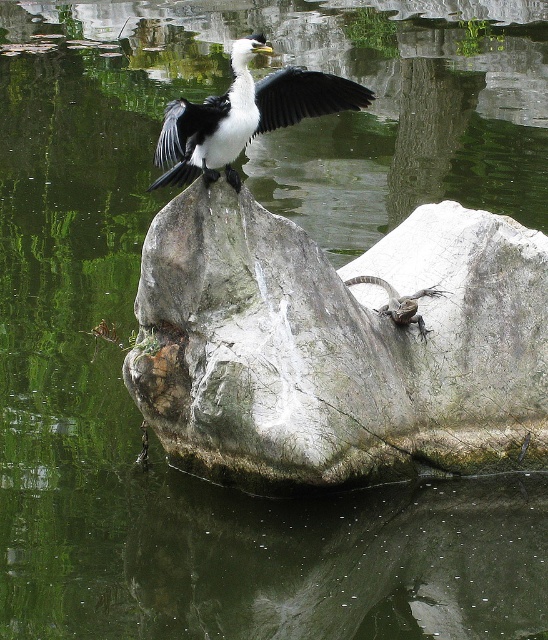
Can you confirm if gray stone boulder at center is shorter than white-feathered bird with black wings at center?

Yes.

Between gray stone boulder at center and white-feathered bird with black wings at center, which one appears on the left side from the viewer's perspective?

From the viewer's perspective, white-feathered bird with black wings at center appears more on the left side.

Locate an element on the screen. gray stone boulder at center is located at coordinates (338, 348).

Which of these two, white-feathered bird with black wings at center or black feathered wing at upper center, stands shorter?

black feathered wing at upper center is shorter.

Is the position of white-feathered bird with black wings at center less distant than that of black feathered wing at upper center?

Yes, white-feathered bird with black wings at center is closer to the viewer.

Which is in front, point (288, 70) or point (266, 99)?

Point (288, 70) is in front.

Locate an element on the screen. The width and height of the screenshot is (548, 640). white-feathered bird with black wings at center is located at coordinates (244, 115).

Can you confirm if gray stone boulder at center is smaller than black feathered wing at upper center?

No.

Locate an element on the screen. The height and width of the screenshot is (640, 548). gray stone boulder at center is located at coordinates (338, 348).

Does point (436, 243) come closer to viewer compared to point (322, 106)?

That is False.

In order to click on gray stone boulder at center in this screenshot , I will do `click(338, 348)`.